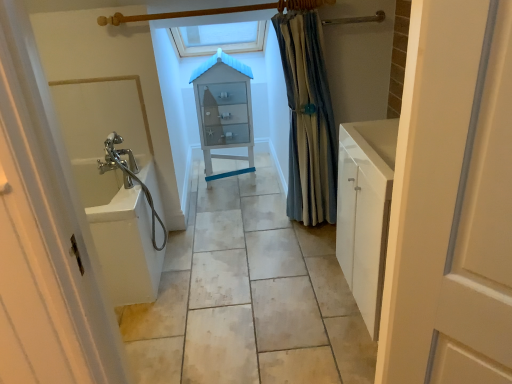
Question: From a real-world perspective, relative to white glossy sink at left, is white glossy bath at left vertically above or below?

Choices:
 (A) above
 (B) below

Answer: (A)

Question: In terms of width, does white glossy bath at left look wider or thinner when compared to white glossy sink at left?

Choices:
 (A) wide
 (B) thin

Answer: (B)

Question: Which of these objects is positioned closest to the translucent glass cabinet at center?

Choices:
 (A) white glossy bath at left
 (B) white matte door at right
 (C) blue striped fabric at right
 (D) white glossy sink at left

Answer: (C)

Question: Which is farther from the white glossy bath at left?

Choices:
 (A) white matte door at right
 (B) translucent glass cabinet at center
 (C) white glossy sink at left
 (D) blue striped fabric at right

Answer: (A)